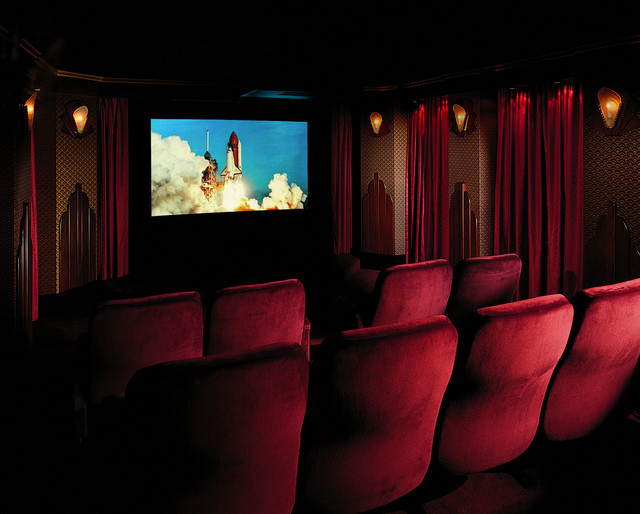
At what (x,y) coordinates should I click in order to perform the action: click on screen. Please return your answer as a coordinate pair (x, y). The width and height of the screenshot is (640, 514). Looking at the image, I should click on (276, 176).